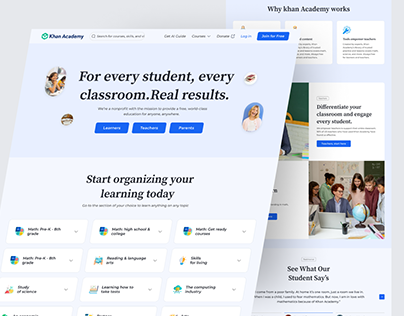
Image resolution: width=404 pixels, height=316 pixels. I want to click on computer, so click(328, 219).